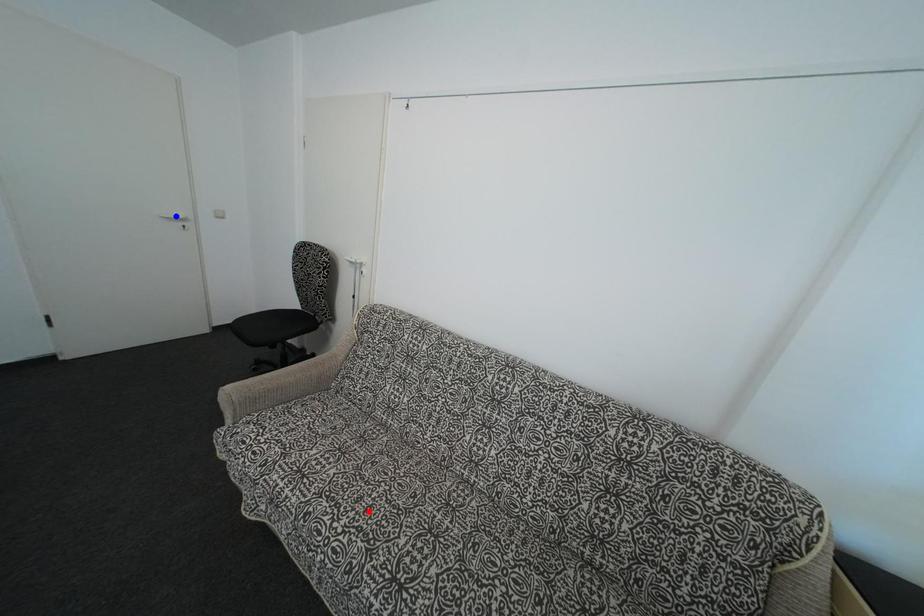
Question: Two points are marked on the image. Which point is closer to the camera?

Choices:
 (A) Blue point is closer.
 (B) Red point is closer.

Answer: (B)